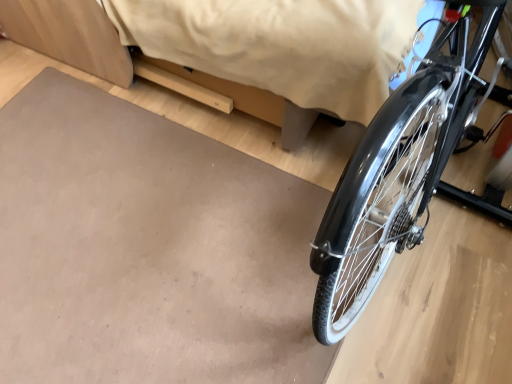
Identify the location of free space below matte gray mat at lower right (from a real-world perspective). (110, 277).